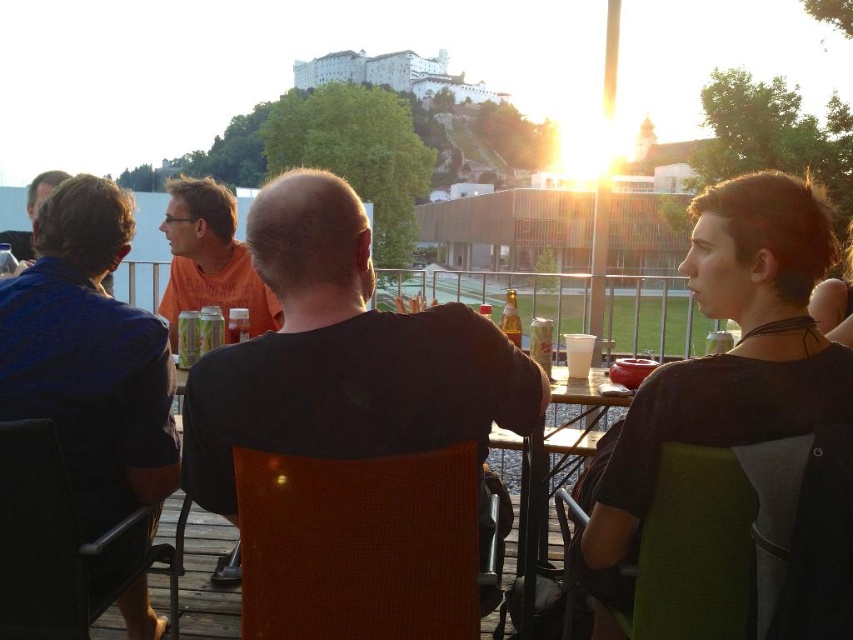
Question: Is blue cotton shirt at left behind wooden table at center?

Choices:
 (A) yes
 (B) no

Answer: (B)

Question: Which point is closer to the camera taking this photo?

Choices:
 (A) (509, 291)
 (B) (520, 408)
 (C) (619, 513)

Answer: (C)

Question: Can you confirm if blue cotton shirt at left is wider than orange cotton shirt at center?

Choices:
 (A) yes
 (B) no

Answer: (B)

Question: Where is black matte shirt at right located in relation to wooden table at center in the image?

Choices:
 (A) above
 (B) below

Answer: (A)

Question: Which object is the farthest from the blue cotton shirt at left?

Choices:
 (A) translucent glass beer at table center
 (B) dark gray shirt at center

Answer: (A)

Question: Which object is farther from the camera taking this photo?

Choices:
 (A) black matte shirt at right
 (B) blue cotton shirt at left
 (C) translucent glass beer at table center
 (D) wooden table at center

Answer: (D)